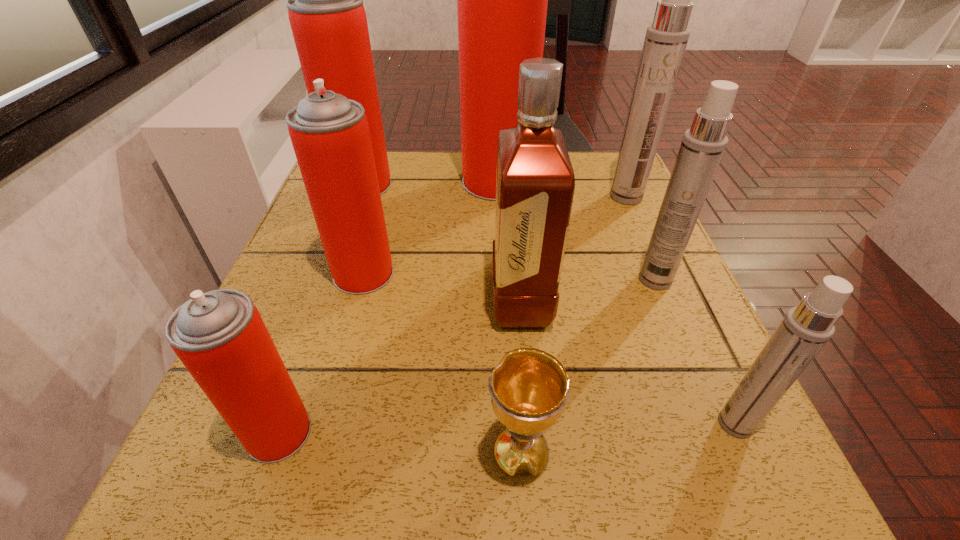
This screenshot has height=540, width=960. In order to click on the shortest object in this screenshot , I will do `click(529, 387)`.

Where is `free space located on the right of the fourth aerosol can from right to left`? This screenshot has height=540, width=960. free space located on the right of the fourth aerosol can from right to left is located at coordinates (593, 182).

Where is `vacant point located 0.370m on the front of the third smallest red aerosol can`? The width and height of the screenshot is (960, 540). vacant point located 0.370m on the front of the third smallest red aerosol can is located at coordinates (312, 321).

Find the location of `blank space located 0.170m on the left of the farthest white aerosol can`. blank space located 0.170m on the left of the farthest white aerosol can is located at coordinates (538, 197).

Find the location of `free space located on the front label of the liquor`. free space located on the front label of the liquor is located at coordinates (336, 301).

Locate an element on the screen. The image size is (960, 540). vacant space situated on the front label of the liquor is located at coordinates (459, 301).

At what (x,y) coordinates should I click in order to perform the action: click on vacant space situated 0.260m on the front label of the liquor. Please return your answer as a coordinate pair (x, y). This screenshot has height=540, width=960. Looking at the image, I should click on (348, 301).

Where is `vacant space located on the front of the third biggest red aerosol can`? This screenshot has width=960, height=540. vacant space located on the front of the third biggest red aerosol can is located at coordinates (307, 472).

At what (x,y) coordinates should I click in order to perform the action: click on free space located on the left of the second nearest white aerosol can. Please return your answer as a coordinate pair (x, y). Image resolution: width=960 pixels, height=540 pixels. Looking at the image, I should click on (447, 280).

At what (x,y) coordinates should I click in order to perform the action: click on vacant space situated on the back of the smallest red aerosol can. Please return your answer as a coordinate pair (x, y). Looking at the image, I should click on (339, 264).